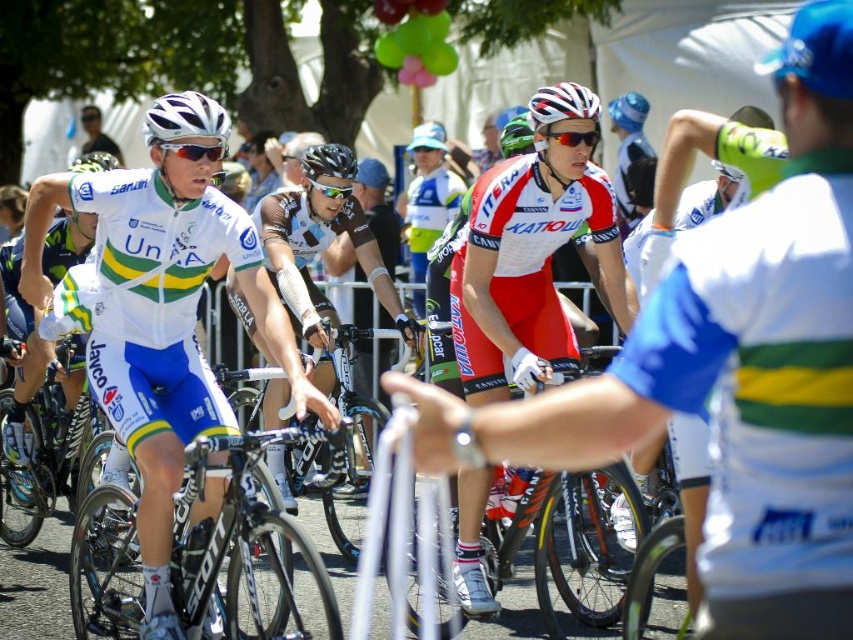
You are a photographer trying to capture a cyclist in the middle of the race. You notice the silver metallic bicycle at center and the black matte bicycle helmet at center. Which object is positioned lower in the image?

The silver metallic bicycle at center is located below the black matte bicycle helmet at center, so the silver metallic bicycle at center is positioned lower in the image.

You are a photographer at the cycling race. You need to capture a photo where both the white matte bicycle helmet at upper center and the black matte bicycle helmet at center are visible. Based on their positions, which helmet should you focus on first to ensure both are in frame?

The white matte bicycle helmet at upper center is shorter than the black matte bicycle helmet at center, so you should focus on the black matte bicycle helmet at center first to ensure both are in frame.

You are a photographer at the cycling race. You want to capture a photo of the cyclist wearing the white matte jersey at center and the black matte bicycle helmet at center. From the cyclist perspective, which object is on the left side?

The white matte jersey at center is positioned on the left side of black matte bicycle helmet at center, so from the cyclist perspective, the white matte jersey at center is on the left side.